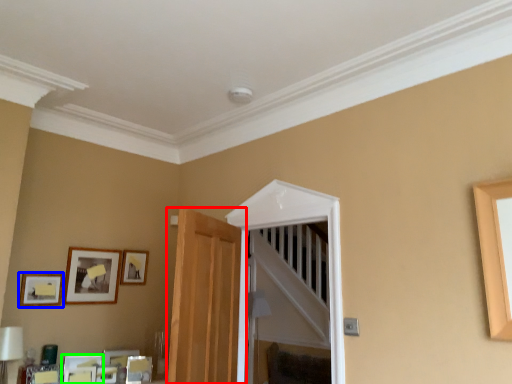
Question: Which is nearer to the door (highlighted by a red box)? picture frame (highlighted by a blue box) or picture frame (highlighted by a green box).

Choices:
 (A) picture frame
 (B) picture frame

Answer: (B)